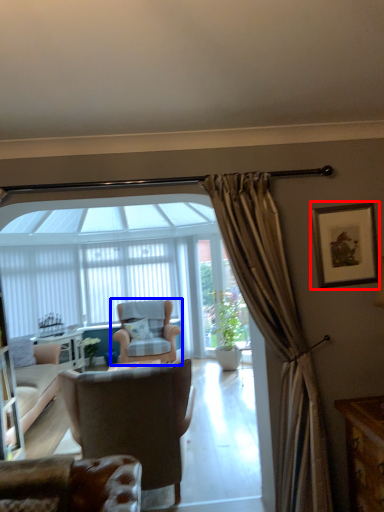
Question: Which of the following is the closest to the observer, picture frame (highlighted by a red box) or chair (highlighted by a blue box)?

Choices:
 (A) picture frame
 (B) chair

Answer: (A)